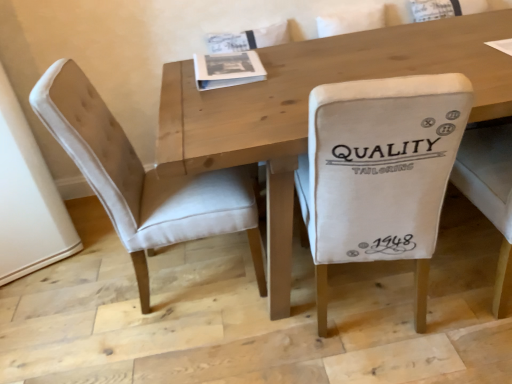
Question: Does white fabric chair at center, the 2th chair when ordered from left to right, have a lesser height compared to white paper book at center?

Choices:
 (A) no
 (B) yes

Answer: (A)

Question: Is white fabric chair at center, the 2th chair when ordered from left to right, looking in the opposite direction of white paper book at center?

Choices:
 (A) no
 (B) yes

Answer: (A)

Question: From a real-world perspective, is white fabric chair at center, the first chair from the right, under white paper book at center?

Choices:
 (A) no
 (B) yes

Answer: (B)

Question: Is white fabric chair at center, the 2th chair when ordered from left to right, positioned beyond the bounds of white paper book at center?

Choices:
 (A) no
 (B) yes

Answer: (B)

Question: Does white fabric chair at center, the first chair from the right, appear on the left side of white paper book at center?

Choices:
 (A) yes
 (B) no

Answer: (B)

Question: Is beige fabric chair at left, the 1th chair in the left-to-right sequence, spatially inside white paper book at center, or outside of it?

Choices:
 (A) outside
 (B) inside

Answer: (A)

Question: Looking at the image, does beige fabric chair at left, the 1th chair in the left-to-right sequence, seem bigger or smaller compared to white paper book at center?

Choices:
 (A) small
 (B) big

Answer: (B)

Question: Would you say beige fabric chair at left, the 1th chair in the left-to-right sequence, is to the left or to the right of white paper book at center in the picture?

Choices:
 (A) right
 (B) left

Answer: (B)

Question: Relative to white paper book at center, is beige fabric chair at left, the 2th chair in the right-to-left sequence, in front or behind?

Choices:
 (A) behind
 (B) front

Answer: (B)

Question: Choose the correct answer: Is white paper book at center inside white fabric chair at center, the 2th chair when ordered from left to right, or outside it?

Choices:
 (A) outside
 (B) inside

Answer: (A)

Question: Is point (250, 77) closer or farther from the camera than point (407, 82)?

Choices:
 (A) closer
 (B) farther

Answer: (B)

Question: Considering the positions of white paper book at center and white fabric chair at center, the first chair from the right, in the image, is white paper book at center bigger or smaller than white fabric chair at center, the first chair from the right,?

Choices:
 (A) big
 (B) small

Answer: (B)

Question: Considering the positions of white paper book at center and white fabric chair at center, the first chair from the right, in the image, is white paper book at center taller or shorter than white fabric chair at center, the first chair from the right,?

Choices:
 (A) tall
 (B) short

Answer: (B)

Question: Considering the relative positions of white fabric chair at center, the first chair from the right, and beige fabric chair at left, the 1th chair in the left-to-right sequence, in the image provided, is white fabric chair at center, the first chair from the right, to the left or to the right of beige fabric chair at left, the 1th chair in the left-to-right sequence,?

Choices:
 (A) right
 (B) left

Answer: (A)

Question: Is white fabric chair at center, the 2th chair when ordered from left to right, taller or shorter than beige fabric chair at left, the 1th chair in the left-to-right sequence?

Choices:
 (A) short
 (B) tall

Answer: (A)